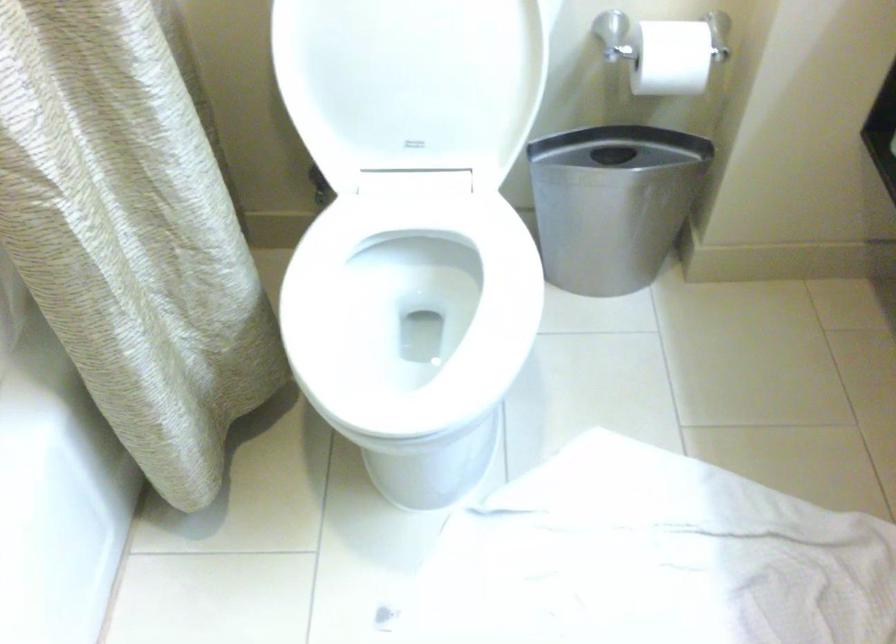
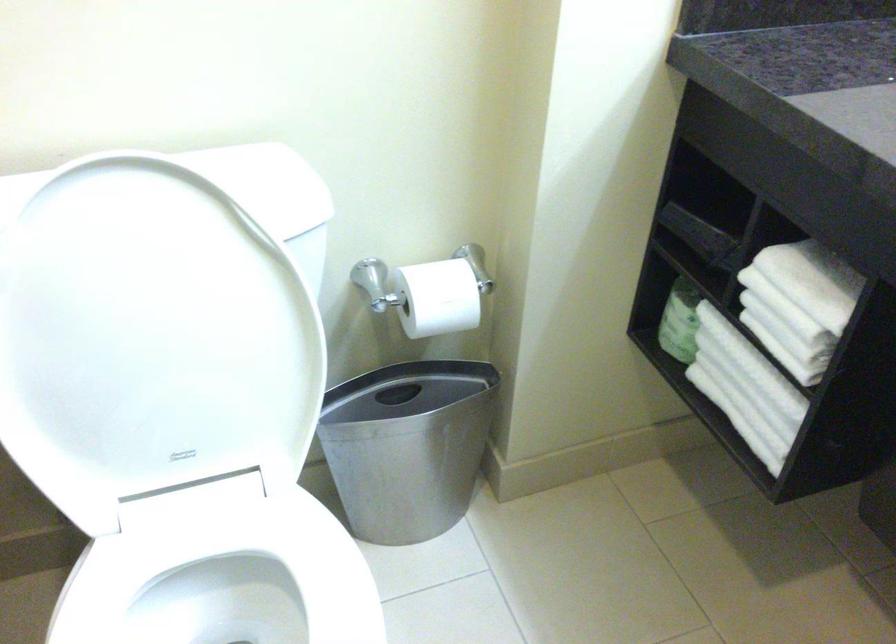
Where in the second image is the point corresponding to point (424, 260) from the first image?

(225, 581)